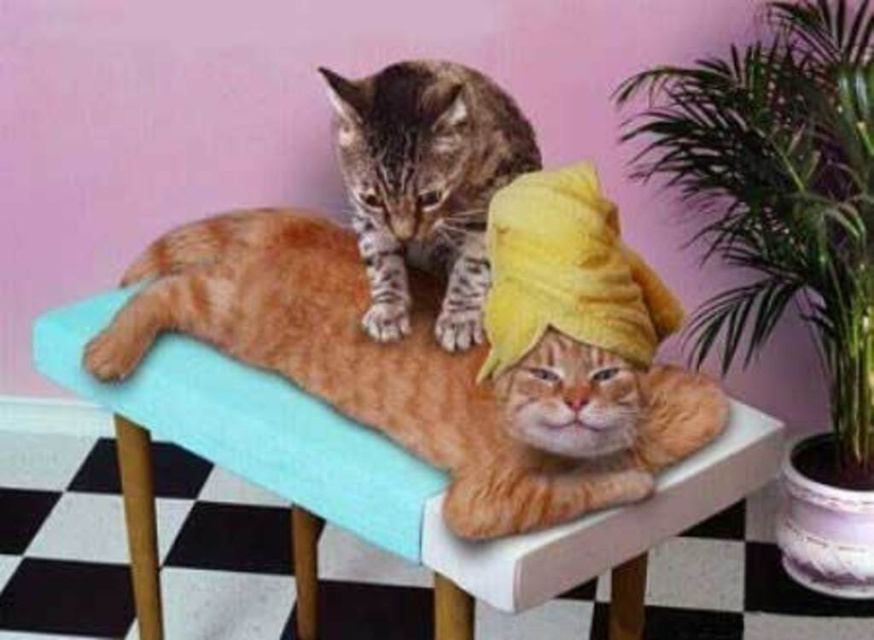
Can you confirm if teal fabric chair at center is positioned to the right of tabby fur cat at upper center?

Incorrect, teal fabric chair at center is not on the right side of tabby fur cat at upper center.

Between teal fabric chair at center and tabby fur cat at upper center, which one is positioned lower?

teal fabric chair at center is below.

You are a GUI agent. You are given a task and a screenshot of the screen. Output one action in this format:
    pyautogui.click(x=<x>, y=<y>)
    Task: Click on the teal fabric chair at center
    The width and height of the screenshot is (874, 640).
    Given the screenshot: What is the action you would take?
    pyautogui.click(x=387, y=465)

Can you confirm if green leafy plant at right is smaller than tabby fur cat at upper center?

No, green leafy plant at right is not smaller than tabby fur cat at upper center.

At what (x,y) coordinates should I click in order to perform the action: click on green leafy plant at right. Please return your answer as a coordinate pair (x, y). This screenshot has height=640, width=874. Looking at the image, I should click on (779, 188).

Locate an element on the screen. Image resolution: width=874 pixels, height=640 pixels. green leafy plant at right is located at coordinates (779, 188).

Describe the element at coordinates (779, 188) in the screenshot. I see `green leafy plant at right` at that location.

Does green leafy plant at right have a lesser height compared to teal fabric chair at center?

Incorrect, green leafy plant at right's height does not fall short of teal fabric chair at center's.

The width and height of the screenshot is (874, 640). Describe the element at coordinates (779, 188) in the screenshot. I see `green leafy plant at right` at that location.

Locate an element on the screen. The image size is (874, 640). green leafy plant at right is located at coordinates (779, 188).